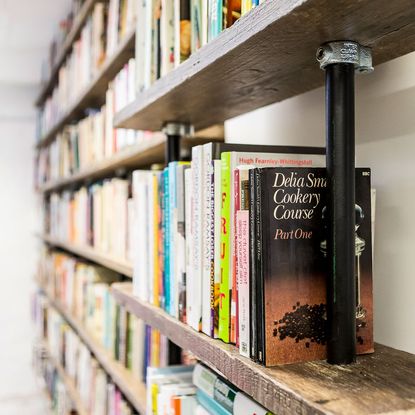
Identify the location of shelf. This screenshot has height=415, width=415. (226, 75), (80, 176), (96, 95), (86, 18), (127, 307), (90, 253), (66, 393), (78, 329).